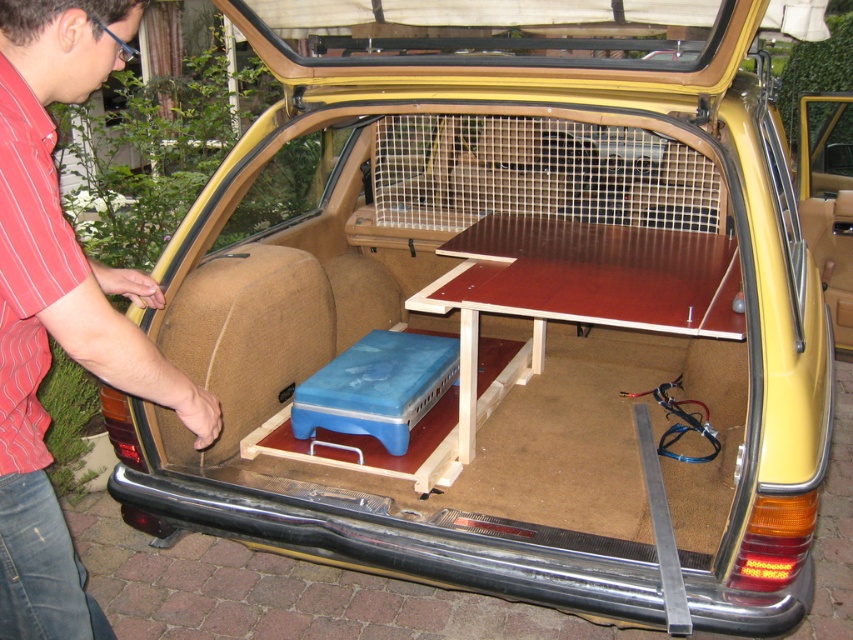
Can you confirm if red striped shirt at left is smaller than brown wooden picnic table at center?

Correct, red striped shirt at left occupies less space than brown wooden picnic table at center.

Does red striped shirt at left have a larger size compared to brown wooden picnic table at center?

No, red striped shirt at left is not bigger than brown wooden picnic table at center.

Locate an element on the screen. Image resolution: width=853 pixels, height=640 pixels. red striped shirt at left is located at coordinates (61, 307).

The image size is (853, 640). I want to click on red striped shirt at left, so click(61, 307).